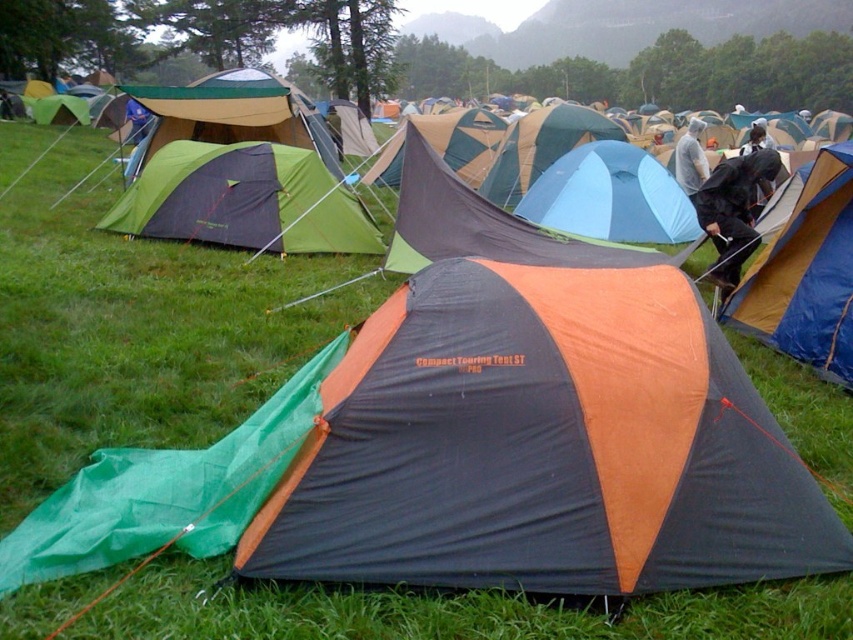
You are setting up a new tent in the camping area. You want to place your tent so that it is not directly under any existing tents. Which tent between the blue tarpaulin tent at center and the orange and gray tent at center should you avoid placing your tent under?

You should avoid placing your tent under the orange and gray tent at center because the blue tarpaulin tent at center is positioned under it, meaning the orange and gray tent is overhead.

You are a camper who wants to set up a new tent in the camping area. You notice the blue tarpaulin tent at center and the orange and gray tent at center. Which tent is closer to you if you are standing at the entrance of the camping area?

The blue tarpaulin tent at center is closer to you because the orange and gray tent at center is behind it.